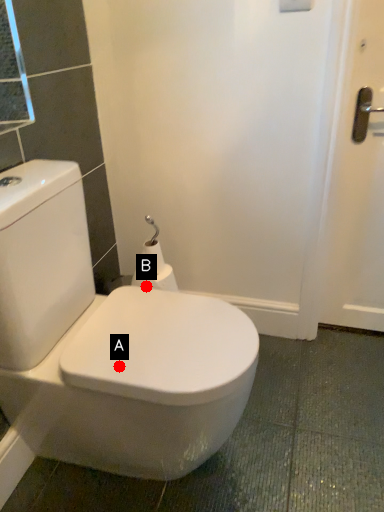
Question: Two points are circled on the image, labeled by A and B beside each circle. Which point is closer to the camera taking this photo?

Choices:
 (A) A is closer
 (B) B is closer

Answer: (A)